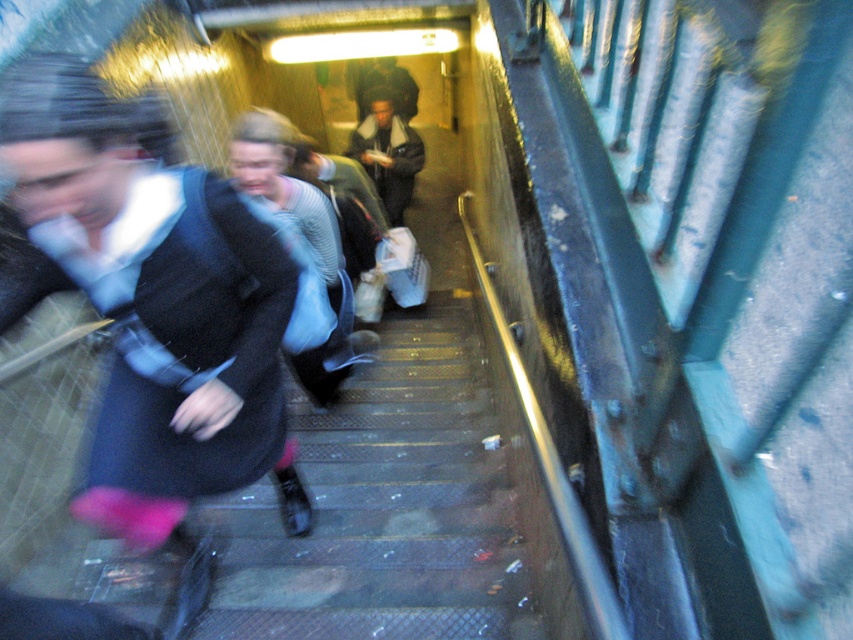
You are a photographer trying to capture a clear shot of the dark gray jacket at center and the dark brown leather jacket at center in the subway scene. Since the jackets are both at the center, which jacket is closer to the camera?

The dark gray jacket at center is in front of the dark brown leather jacket at center, so the dark gray jacket at center is closer to the camera.

You are a photographer trying to capture a clear shot of the matte black coat at left and the dark gray jacket at center in this dimly lit subway scene. Since the camera requires focusing on the wider object first for better lighting adjustment, which object should you focus on first?

The dark gray jacket at center has a greater width than the matte black coat at left, so you should focus on the dark gray jacket at center first for better lighting adjustment.

You are standing at the bottom of the metal staircase in the subway passage. You see a point marked at coordinates (148, 305). What object is located at that point?

The point at coordinates (148, 305) indicates a matte black coat at left.